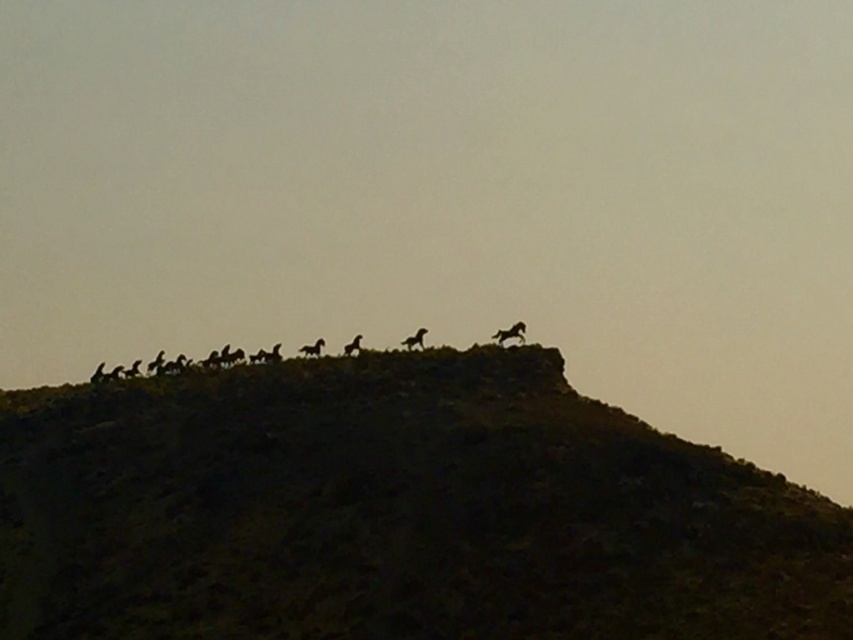
Between point (305, 344) and point (100, 372), which one is positioned in front?

Point (305, 344)

Locate an element on the screen. The height and width of the screenshot is (640, 853). black matte horse at center is located at coordinates (312, 348).

Does dark brown textured hillside at upper center have a lesser width compared to black matte horse at upper center?

In fact, dark brown textured hillside at upper center might be wider than black matte horse at upper center.

Is point (15, 612) positioned before point (500, 336)?

Yes, it is in front of point (500, 336).

This screenshot has width=853, height=640. I want to click on dark brown textured hillside at upper center, so tap(395, 512).

Does black matte horse at center appear on the left side of silhouette fur at upper center?

Correct, you'll find black matte horse at center to the left of silhouette fur at upper center.

Is black matte horse at center thinner than silhouette fur at upper center?

In fact, black matte horse at center might be wider than silhouette fur at upper center.

Find the location of a particular element. Image resolution: width=853 pixels, height=640 pixels. black matte horse at center is located at coordinates (312, 348).